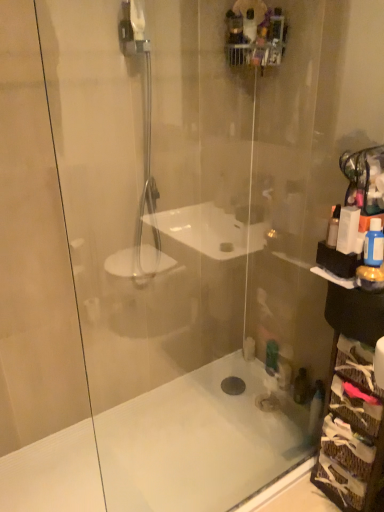
Question: Considering the relative sizes of white plastic box at right, the 2th toiletry when ordered from left to right, and white plastic bottle at right, the 3th toiletry in the right-to-left sequence, in the image provided, is white plastic box at right, the 2th toiletry when ordered from left to right, thinner than white plastic bottle at right, the 3th toiletry in the right-to-left sequence,?

Choices:
 (A) yes
 (B) no

Answer: (B)

Question: Considering the relative sizes of white plastic box at right, the 2th toiletry when ordered from left to right, and white plastic bottle at right, the 3th toiletry in the right-to-left sequence, in the image provided, is white plastic box at right, the 2th toiletry when ordered from left to right, wider than white plastic bottle at right, the 3th toiletry in the right-to-left sequence,?

Choices:
 (A) no
 (B) yes

Answer: (B)

Question: Is white plastic box at right, which is the 2th toiletry from right to left, next to white plastic bottle at right, the first toiletry when ordered from left to right, and touching it?

Choices:
 (A) no
 (B) yes

Answer: (B)

Question: Can white plastic bottle at right, the first toiletry when ordered from left to right, be found inside white plastic box at right, the 2th toiletry when ordered from left to right?

Choices:
 (A) yes
 (B) no

Answer: (B)

Question: Does white plastic box at right, which is the 2th toiletry from right to left, lie behind white plastic bottle at right, the first toiletry when ordered from left to right?

Choices:
 (A) yes
 (B) no

Answer: (B)

Question: Considering the positions of point (327, 426) and point (374, 265), is point (327, 426) closer or farther from the camera than point (374, 265)?

Choices:
 (A) closer
 (B) farther

Answer: (B)

Question: In terms of height, does woven basket at right look taller or shorter compared to blue glossy bottle at right, arranged as the 1th toiletry when viewed from the right?

Choices:
 (A) tall
 (B) short

Answer: (A)

Question: Which is correct: woven basket at right is inside blue glossy bottle at right, the third toiletry in the left-to-right sequence, or outside of it?

Choices:
 (A) outside
 (B) inside

Answer: (A)

Question: Considering the positions of woven basket at right and blue glossy bottle at right, the third toiletry in the left-to-right sequence, in the image, is woven basket at right wider or thinner than blue glossy bottle at right, the third toiletry in the left-to-right sequence,?

Choices:
 (A) wide
 (B) thin

Answer: (A)

Question: From a real-world perspective, is blue glossy bottle at right, arranged as the 1th toiletry when viewed from the right, positioned above or below white plastic box at right, the 2th toiletry when ordered from left to right?

Choices:
 (A) below
 (B) above

Answer: (A)

Question: Considering their positions, is blue glossy bottle at right, the third toiletry in the left-to-right sequence, located in front of or behind white plastic box at right, the 2th toiletry when ordered from left to right?

Choices:
 (A) front
 (B) behind

Answer: (A)

Question: Is blue glossy bottle at right, arranged as the 1th toiletry when viewed from the right, taller or shorter than white plastic box at right, which is the 2th toiletry from right to left?

Choices:
 (A) tall
 (B) short

Answer: (B)

Question: Is point (377, 260) positioned closer to the camera than point (350, 222)?

Choices:
 (A) farther
 (B) closer

Answer: (B)

Question: Considering the positions of white plastic bottle at right, the 3th toiletry in the right-to-left sequence, and white matte bathtub at lower center in the image, is white plastic bottle at right, the 3th toiletry in the right-to-left sequence, taller or shorter than white matte bathtub at lower center?

Choices:
 (A) short
 (B) tall

Answer: (B)

Question: From the image's perspective, is white plastic bottle at right, the first toiletry when ordered from left to right, located above or below white matte bathtub at lower center?

Choices:
 (A) above
 (B) below

Answer: (A)